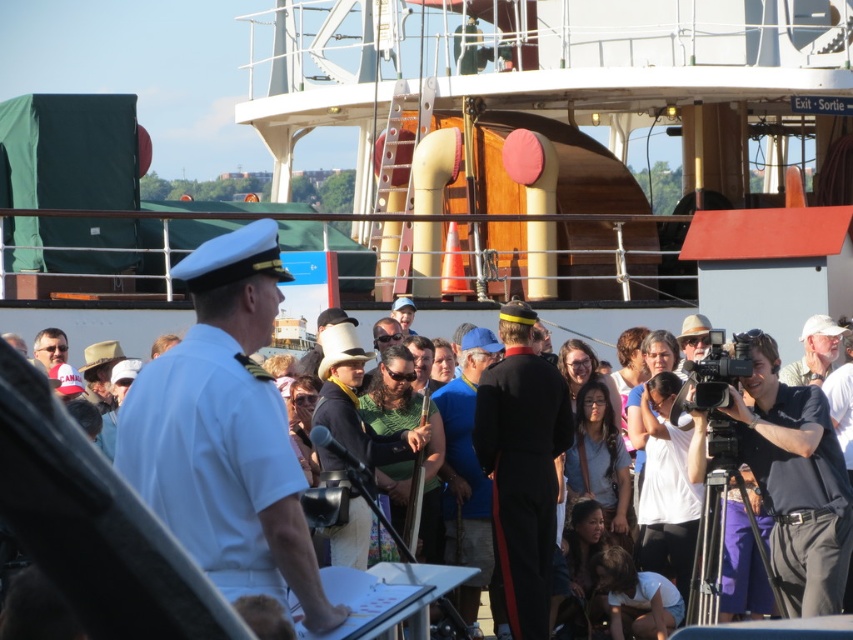
Question: Which point appears farthest from the camera in this image?

Choices:
 (A) (331, 435)
 (B) (764, 490)
 (C) (247, 440)
 (D) (397, 298)

Answer: (D)

Question: Which point is farther from the camera taking this photo?

Choices:
 (A) (372, 513)
 (B) (410, 300)

Answer: (B)

Question: Which is farther from the black cotton shirt at right?

Choices:
 (A) blue fabric shirt at center
 (B) green fabric shirt at center
 (C) black uniform at center

Answer: (B)

Question: Is black uniform at center wider than matte white cap at center?

Choices:
 (A) yes
 (B) no

Answer: (A)

Question: Does blue fabric shirt at center come behind gray fabric cap at right?

Choices:
 (A) yes
 (B) no

Answer: (B)

Question: Does black cotton shirt at right have a larger size compared to blue fabric shirt at center?

Choices:
 (A) yes
 (B) no

Answer: (B)